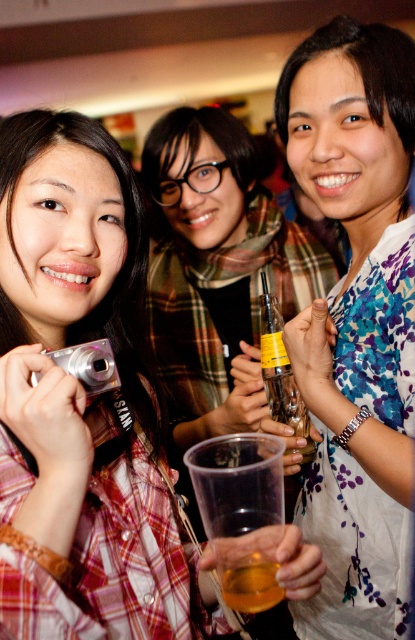
Is matte black camera at left to the right of translucent plastic cup at center from the viewer's perspective?

No, matte black camera at left is not to the right of translucent plastic cup at center.

Is point (149, 518) positioned in front of point (275, 563)?

No, it is not.

The height and width of the screenshot is (640, 415). Describe the element at coordinates (83, 403) in the screenshot. I see `matte black camera at left` at that location.

Locate an element on the screen. The width and height of the screenshot is (415, 640). matte black camera at left is located at coordinates (83, 403).

Does matte black camera at left lie behind silver metallic camera at lower left?

No, matte black camera at left is in front of silver metallic camera at lower left.

Who is positioned more to the right, matte black camera at left or silver metallic camera at lower left?

matte black camera at left

Does point (117, 179) lie behind point (99, 342)?

Yes.

The image size is (415, 640). Find the location of `matte black camera at left`. matte black camera at left is located at coordinates (83, 403).

Is silver metallic camera at lower left below translucent plastic cup at center?

Incorrect, silver metallic camera at lower left is not positioned below translucent plastic cup at center.

Describe the element at coordinates (90, 365) in the screenshot. The width and height of the screenshot is (415, 640). I see `silver metallic camera at lower left` at that location.

You are a GUI agent. You are given a task and a screenshot of the screen. Output one action in this format:
    pyautogui.click(x=<x>, y=<y>)
    Task: Click on the silver metallic camera at lower left
    
    Given the screenshot: What is the action you would take?
    pyautogui.click(x=90, y=365)